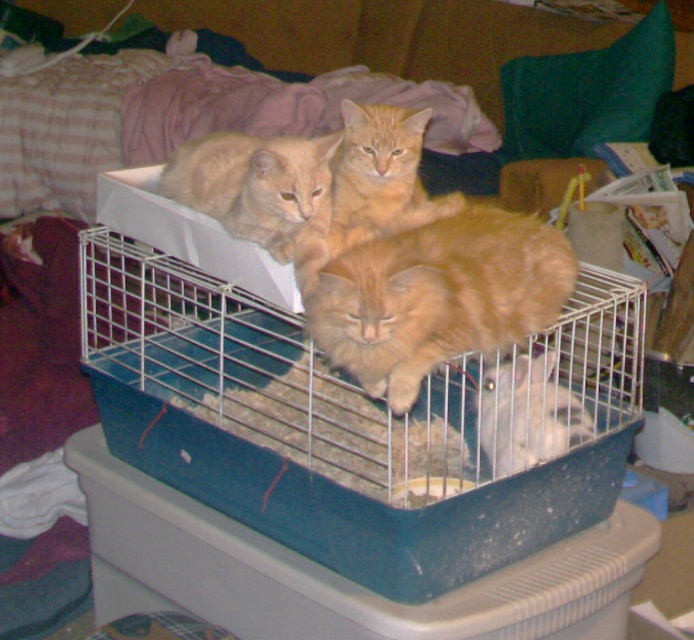
You are a small animal trying to escape from the blue plastic bird cage at center. There is an orange fur cat at upper center nearby. Which direction should you move to avoid the cat?

The blue plastic bird cage at center is in front of orange fur cat at upper center, so to avoid the cat, you should move away from the direction of the orange fur cat at upper center. Since the cage is in front of the cat, moving towards the cage might bring you closer to the cat. Instead, moving away from the cage in the opposite direction of the cat would be safer.

Consider the image. You are a pet owner who wants to place a new toy for the fluffy orange cat at center. The toy requires a flat surface. Based on the scene, can you determine if the blue plastic bird cage at center has a flat surface suitable for placing the toy?

The blue plastic bird cage at center is located below the fluffy orange cat at center. Since the cage is positioned under the cat, it might have a flat surface on top where the cat is resting. Therefore, the blue plastic bird cage at center likely has a flat surface suitable for placing the toy.

You are a small animal trying to move from the orange fur cat at upper center to the orange fur cat at center. Which direction should you move to reach it?

The orange fur cat at upper center is located above the orange fur cat at center, so you should move downward to reach it.